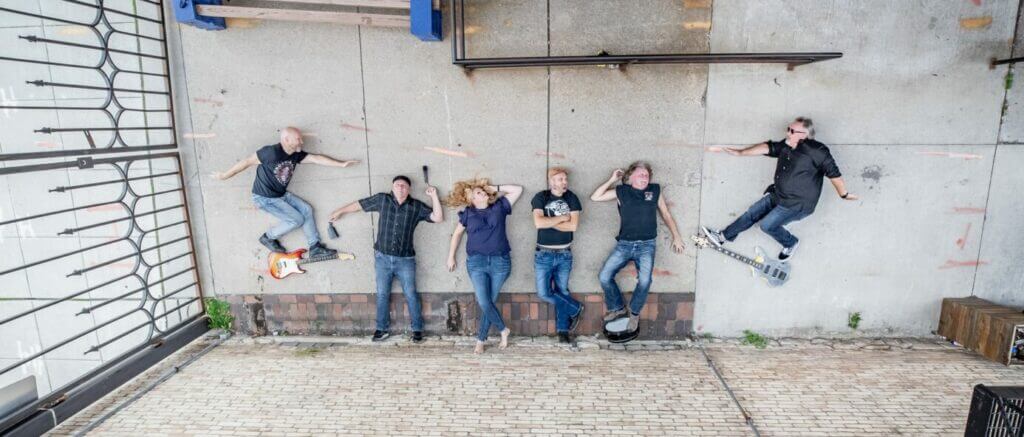
The width and height of the screenshot is (1024, 437). I want to click on brick wall, so click(527, 372).